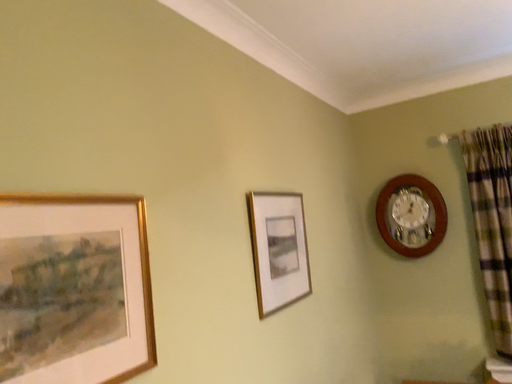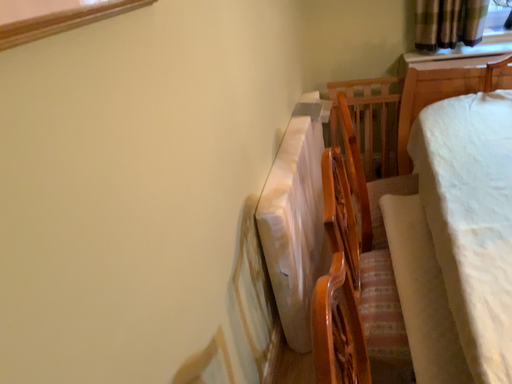
Question: Which way did the camera rotate in the video?

Choices:
 (A) rotated right
 (B) rotated left

Answer: (A)